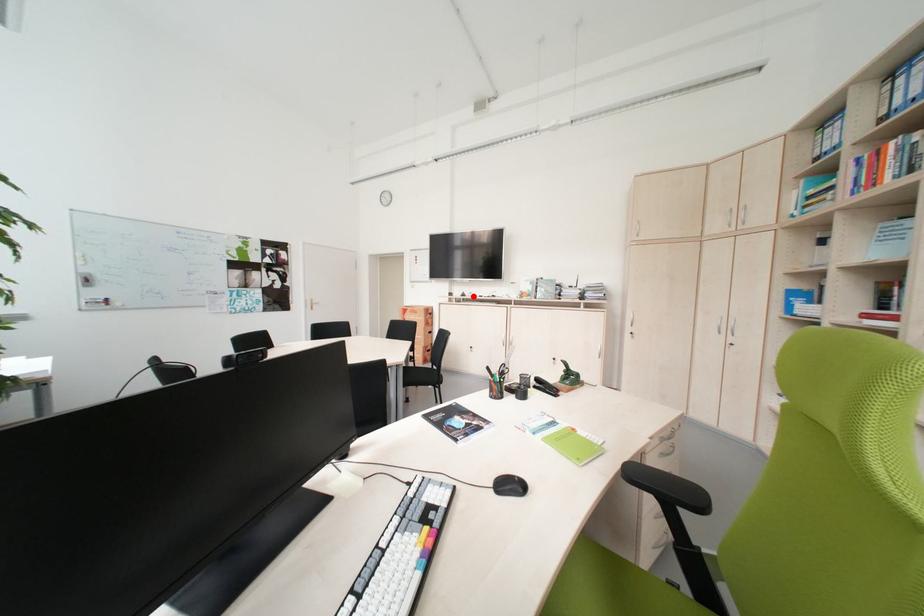
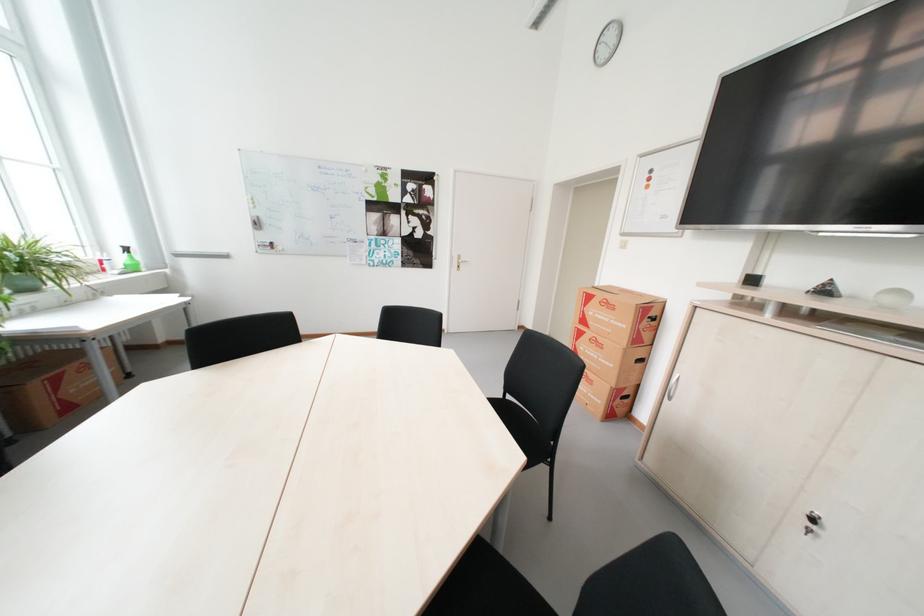
The point at the highlighted location is marked in the first image. Where is the corresponding point in the second image?

(835, 292)